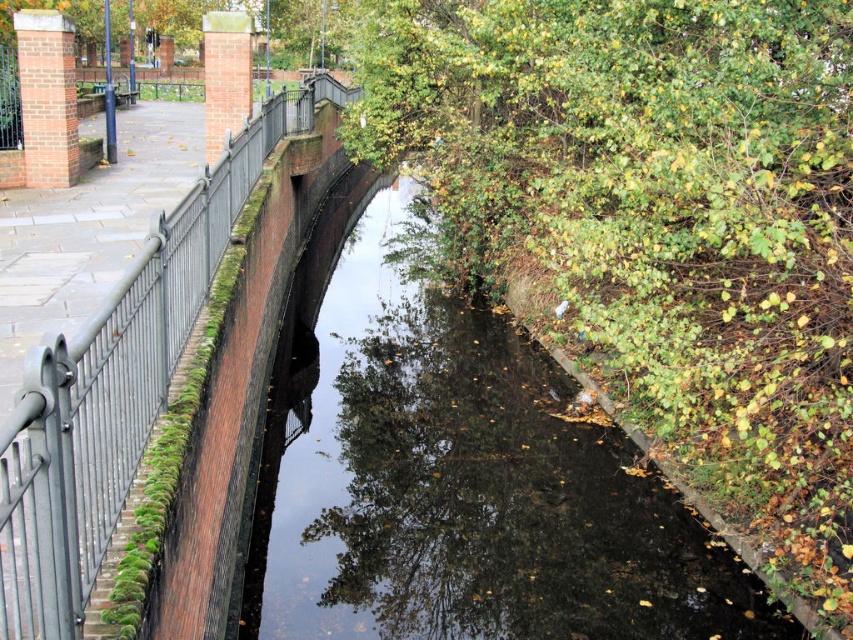
Who is lower down, green leafy tree at upper right or metallic gray fence at left?

green leafy tree at upper right

Does green leafy tree at upper right have a lesser width compared to metallic gray fence at left?

Incorrect, green leafy tree at upper right's width is not less than metallic gray fence at left's.

The width and height of the screenshot is (853, 640). What are the coordinates of `green leafy tree at upper right` in the screenshot? It's located at (659, 221).